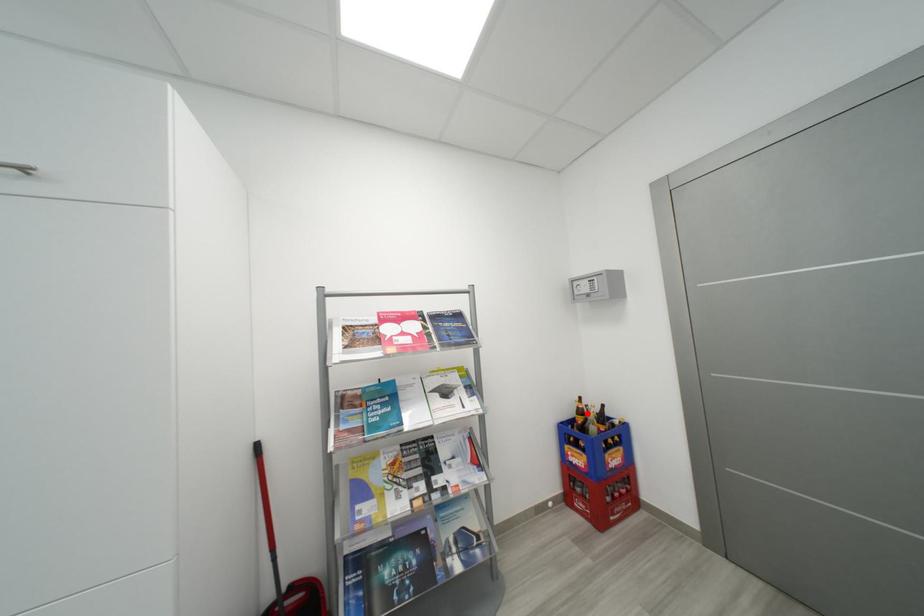
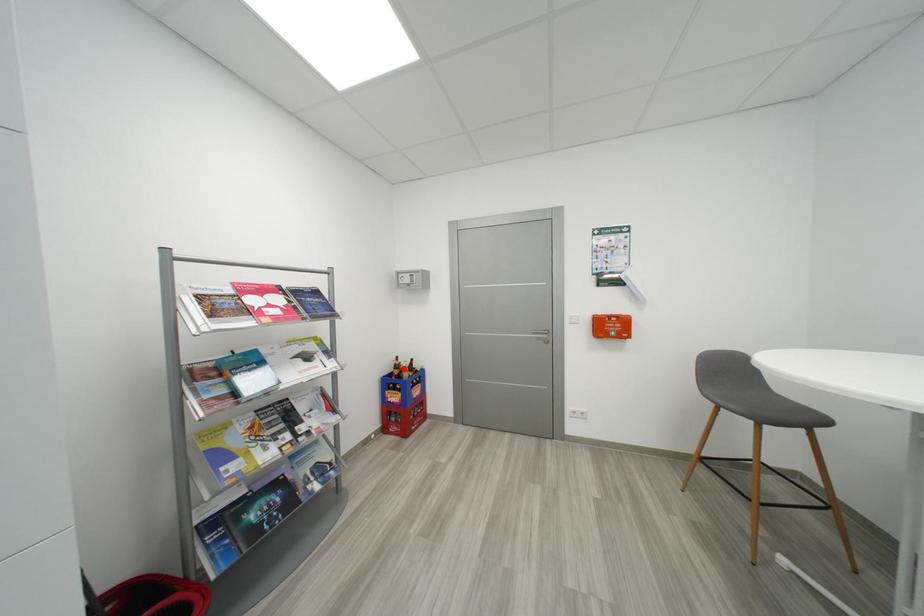
I am providing you with two images of the same scene from different viewpoints. A red point is marked on the first image and another point is marked on the second image. Is the red point in image1 aligned with the point shown in image2?

Yes